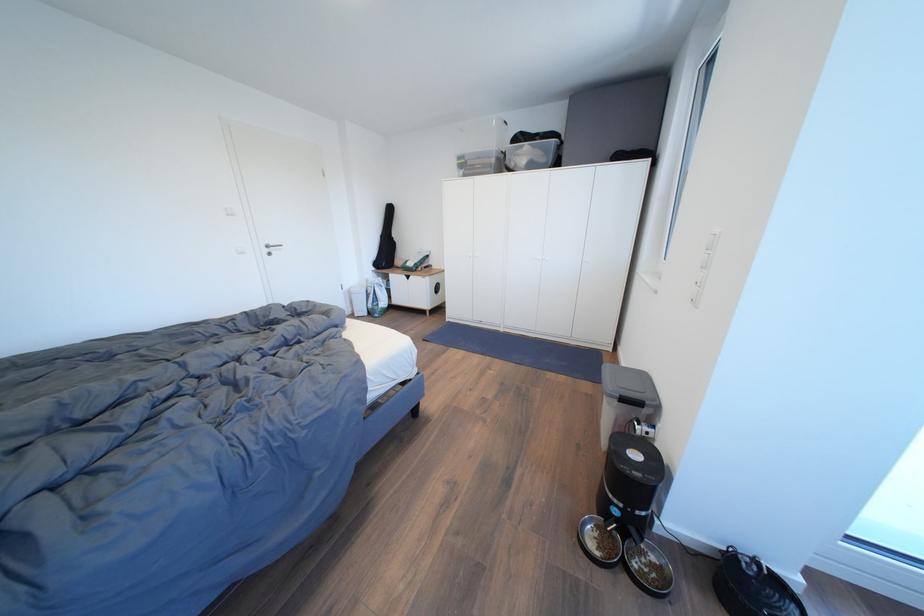
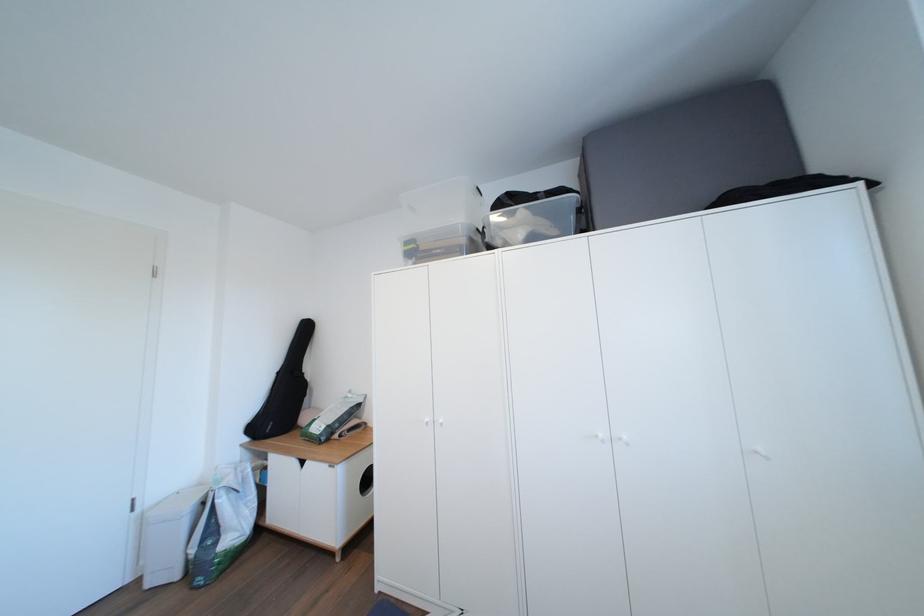
Where in the second image is the point corresponding to pixel 533 151 from the first image?

(529, 215)